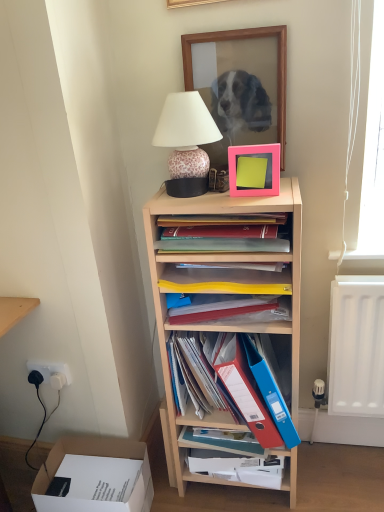
The width and height of the screenshot is (384, 512). In order to click on free space in front of matte pink picture frame at upper center, the 2th picture frame when ordered from top to bottom in this screenshot , I will do `click(269, 199)`.